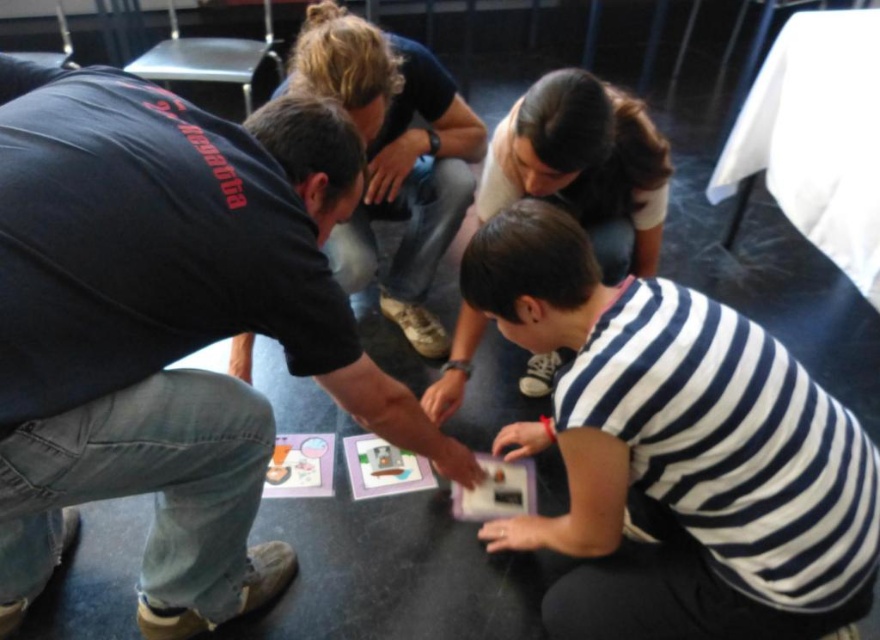
Between point (603, 252) and point (532, 496), which one is positioned in front?

Point (532, 496) is more forward.

Is striped fabric shirt at lower center positioned before white matte card at lower center?

Yes, it is.

Does point (568, 80) come in front of point (455, 508)?

Yes, it is.

Locate an element on the screen. This screenshot has height=640, width=880. striped fabric shirt at lower center is located at coordinates (584, 164).

Looking at this image, is white striped shirt at lower center smaller than dark blue jeans at center?

Yes.

Is white striped shirt at lower center positioned at the back of dark blue jeans at center?

That is False.

Image resolution: width=880 pixels, height=640 pixels. What do you see at coordinates (675, 452) in the screenshot? I see `white striped shirt at lower center` at bounding box center [675, 452].

This screenshot has height=640, width=880. Identify the location of white striped shirt at lower center. click(675, 452).

Who is positioned more to the right, dark blue jeans at center or white matte card at lower center?

white matte card at lower center is more to the right.

Does dark blue jeans at center have a lesser height compared to white matte card at lower center?

In fact, dark blue jeans at center may be taller than white matte card at lower center.

Between point (428, 275) and point (485, 496), which one is positioned in front?

Point (485, 496) is more forward.

The width and height of the screenshot is (880, 640). I want to click on dark blue jeans at center, so click(393, 156).